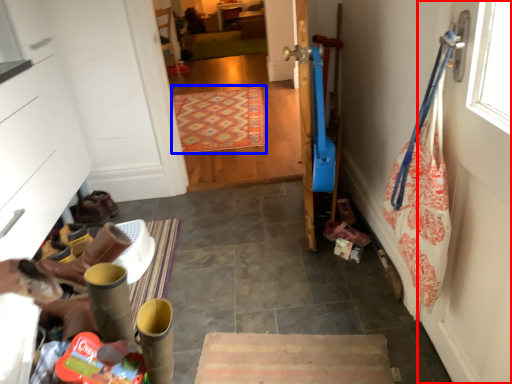
Question: Which object is closer to the camera taking this photo, door (highlighted by a red box) or mat (highlighted by a blue box)?

Choices:
 (A) door
 (B) mat

Answer: (A)